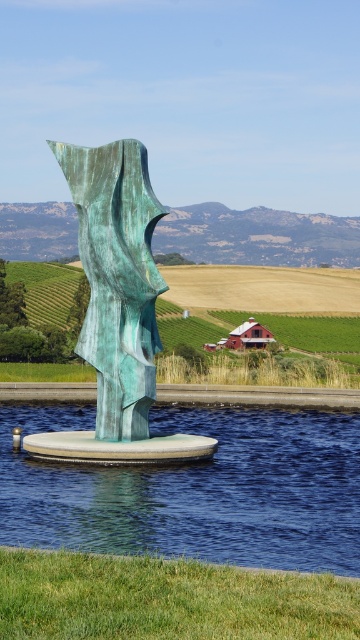
Who is positioned more to the left, clear blue water at center or green grassy field at center?

green grassy field at center is more to the left.

Based on the photo, is clear blue water at center taller than green grassy field at center?

In fact, clear blue water at center may be shorter than green grassy field at center.

Where is `clear blue water at center`? Image resolution: width=360 pixels, height=640 pixels. clear blue water at center is located at coordinates (195, 490).

Who is more distant from viewer, (137, 321) or (286, 348)?

Positioned behind is point (286, 348).

Is green patina sculpture at center in front of green grassy field at center?

Yes, green patina sculpture at center is in front of green grassy field at center.

Which is in front, point (90, 316) or point (316, 355)?

Point (90, 316) is in front.

Where is `green patina sculpture at center`? The height and width of the screenshot is (640, 360). green patina sculpture at center is located at coordinates (117, 308).

Between point (276, 547) and point (137, 452), which one is positioned in front?

Point (276, 547)

Is clear blue water at center shorter than green patina sculpture at center?

Correct, clear blue water at center is not as tall as green patina sculpture at center.

Where is `clear blue water at center`? clear blue water at center is located at coordinates (195, 490).